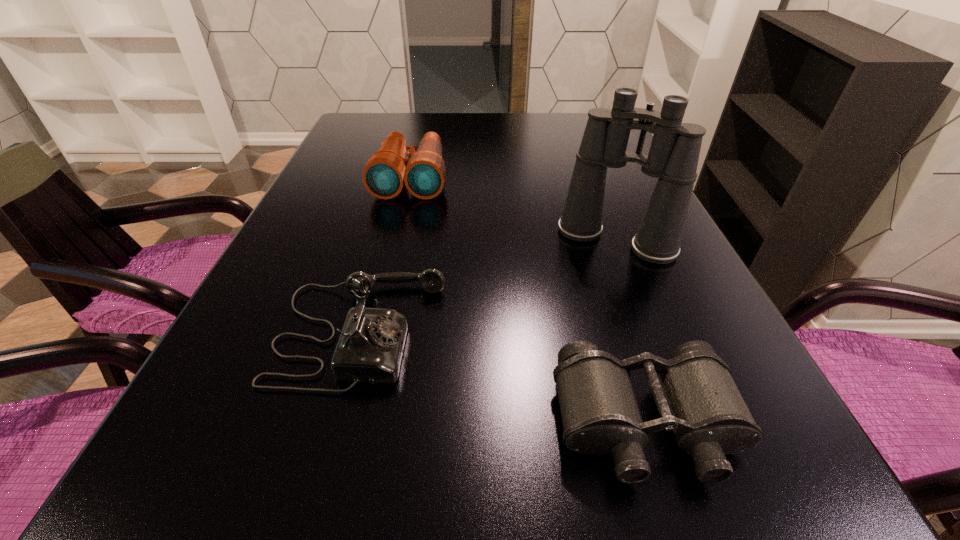
Locate an element on the screen. The image size is (960, 540). the second nearest binoculars is located at coordinates (673, 157).

Locate an element on the screen. the tallest object is located at coordinates (673, 157).

Locate an element on the screen. the farthest binoculars is located at coordinates (423, 172).

Locate an element on the screen. the leftmost binoculars is located at coordinates (423, 172).

The image size is (960, 540). Identify the location of telephone. (369, 350).

At what (x,y) coordinates should I click in order to perform the action: click on the shortest object. Please return your answer as a coordinate pair (x, y). Looking at the image, I should click on (696, 397).

At what (x,y) coordinates should I click in order to perform the action: click on the nearest binoculars. Please return your answer as a coordinate pair (x, y). The width and height of the screenshot is (960, 540). Looking at the image, I should click on (696, 397).

I want to click on free space located on the front of the second nearest binoculars, so click(x=648, y=321).

Where is `free point located 0.390m through the lenses of the farthest object`? free point located 0.390m through the lenses of the farthest object is located at coordinates (376, 321).

Identify the location of free space located 0.290m on the dial of the telephone. Image resolution: width=960 pixels, height=540 pixels. (618, 331).